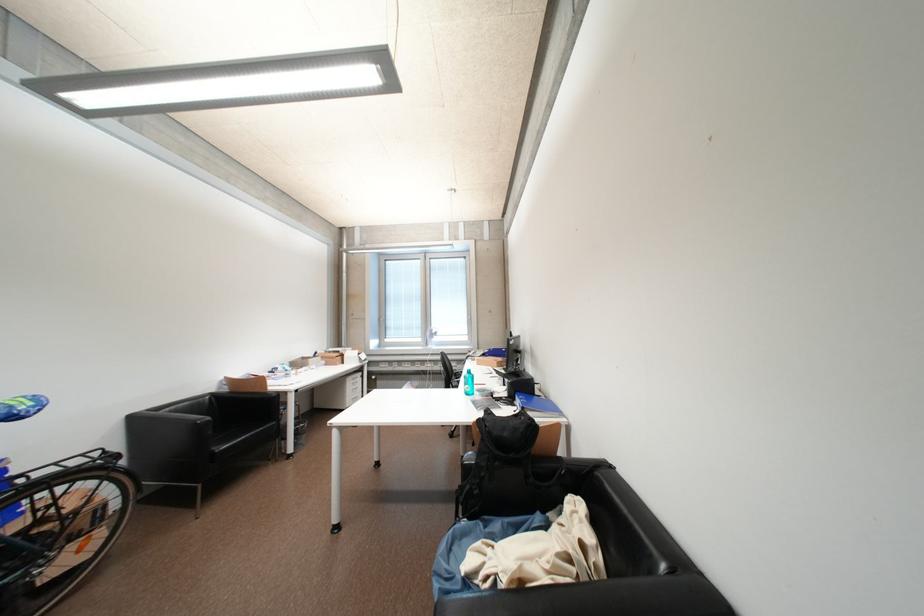
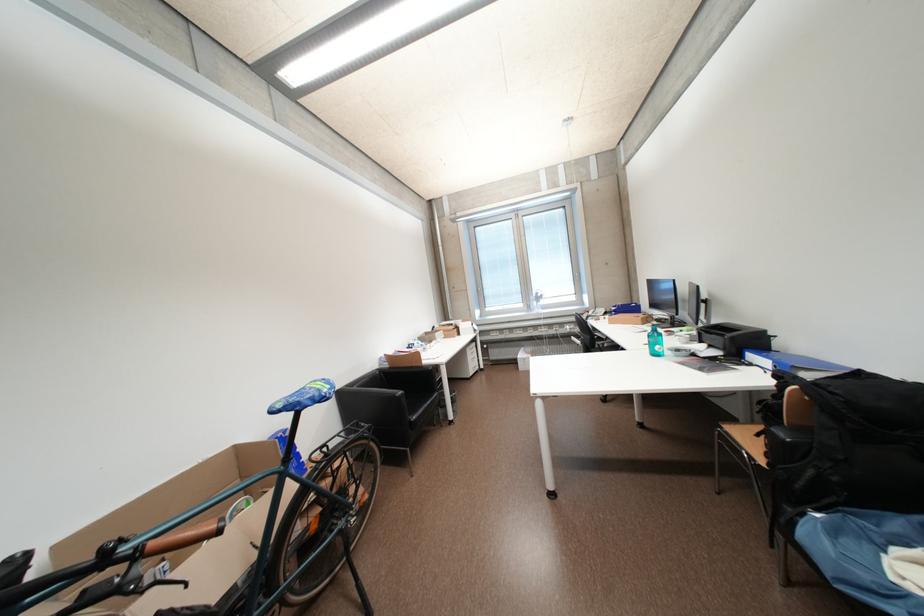
Locate, in the second image, the point that corresponds to point (420, 365) in the first image.

(532, 331)